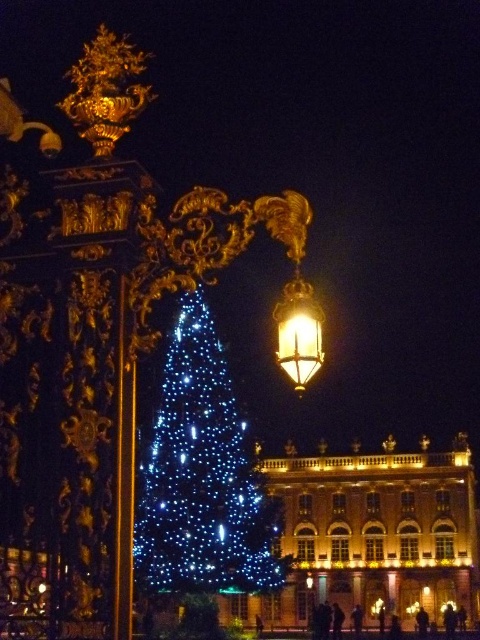
You are standing in the festive nighttime scene and want to locate the gold metallic lantern at upper center. According to the coordinates provided, where exactly is it positioned?

The gold metallic lantern at upper center is positioned at coordinates point (299,332).

You are standing in the festive nighttime scene and want to hang a decoration between the gold metallic lantern at upper center and the gold polished metal street light at center. On which side of the street light should you place it to keep it aligned with the existing decorations?

The gold metallic lantern at upper center is positioned on the left side of the gold polished metal street light at center, so you should place the new decoration on the left side of the street light to maintain alignment with the existing setup.